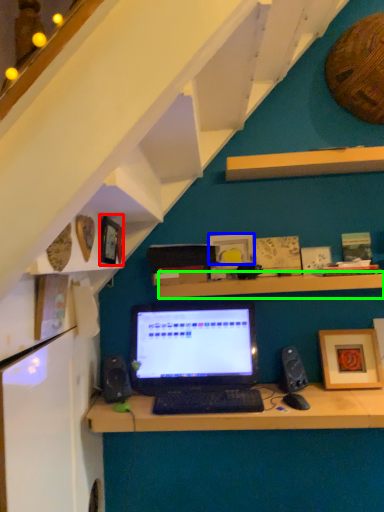
Question: Which is farther away from picture frame (highlighted by a red box)? picture frame (highlighted by a blue box) or shelf (highlighted by a green box)?

Choices:
 (A) picture frame
 (B) shelf

Answer: (A)